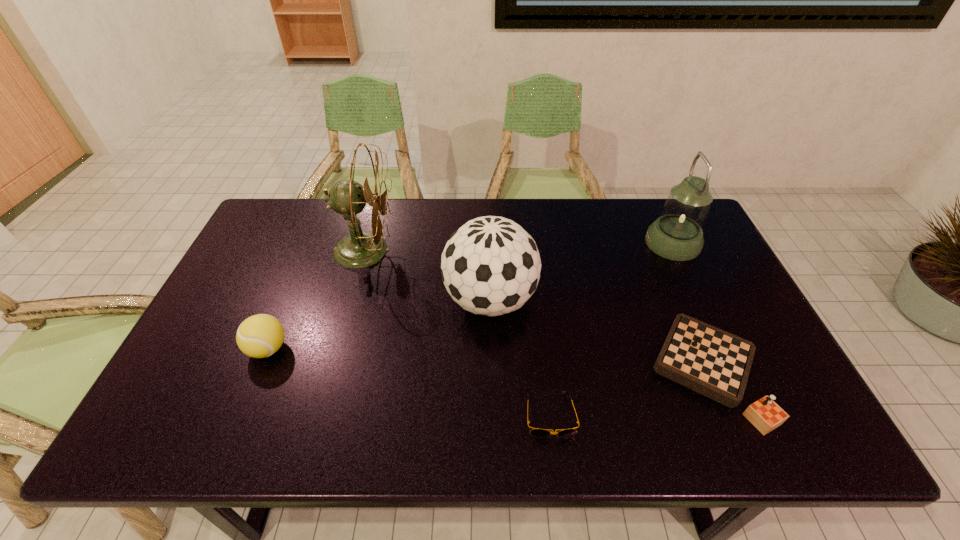
Where is `the second object from left to right`? the second object from left to right is located at coordinates (359, 249).

Locate an element on the screen. The image size is (960, 540). lantern is located at coordinates (677, 234).

In order to click on soccer ball in this screenshot , I will do `click(490, 266)`.

The width and height of the screenshot is (960, 540). Find the location of `the fourth tallest object`. the fourth tallest object is located at coordinates (259, 336).

This screenshot has width=960, height=540. Identify the location of tennis ball. (259, 336).

At what (x,y) coordinates should I click in order to perform the action: click on chessboard. Please return your answer as a coordinate pair (x, y). This screenshot has width=960, height=540. Looking at the image, I should click on (710, 361).

Locate an element on the screen. This screenshot has height=540, width=960. the shortest object is located at coordinates (536, 432).

You are a GUI agent. You are given a task and a screenshot of the screen. Output one action in this format:
    pyautogui.click(x=<x>, y=<y>)
    Task: Click on the vacant space located 0.250m in front of the fan, directing air flow
    The image size is (960, 540).
    Given the screenshot: What is the action you would take?
    pyautogui.click(x=473, y=250)

Locate an element on the screen. The width and height of the screenshot is (960, 540). free space located on the left of the lantern is located at coordinates (562, 243).

Find the location of a particular element. This screenshot has width=960, height=540. free space located on the right of the soccer ball is located at coordinates (613, 300).